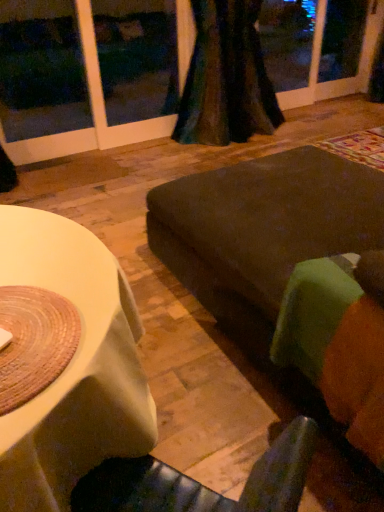
Question: From a real-world perspective, is dark brown fabric couch at center, which appears as the 1th couch when viewed from the back, physically above velvet dark green curtain at upper center?

Choices:
 (A) yes
 (B) no

Answer: (B)

Question: Considering the relative positions of dark brown fabric couch at center, which appears as the 1th couch when viewed from the back, and velvet dark green curtain at upper center in the image provided, is dark brown fabric couch at center, which appears as the 1th couch when viewed from the back, to the right of velvet dark green curtain at upper center from the viewer's perspective?

Choices:
 (A) yes
 (B) no

Answer: (A)

Question: Considering the relative sizes of dark brown fabric couch at center, which appears as the 1th couch when viewed from the back, and velvet dark green curtain at upper center in the image provided, is dark brown fabric couch at center, which appears as the 1th couch when viewed from the back, taller than velvet dark green curtain at upper center?

Choices:
 (A) no
 (B) yes

Answer: (A)

Question: Is the depth of dark brown fabric couch at center, which appears as the 1th couch when viewed from the back, less than that of velvet dark green curtain at upper center?

Choices:
 (A) no
 (B) yes

Answer: (B)

Question: From the image's perspective, is dark brown fabric couch at center, placed as the second couch when sorted from front to back, on velvet dark green curtain at upper center?

Choices:
 (A) no
 (B) yes

Answer: (A)

Question: Looking at the image, does dark brown fabric couch at center, which appears as the 1th couch when viewed from the back, seem bigger or smaller compared to velvet dark green curtain at upper center?

Choices:
 (A) big
 (B) small

Answer: (A)

Question: Is dark brown fabric couch at center, which appears as the 1th couch when viewed from the back, to the left or to the right of velvet dark green curtain at upper center in the image?

Choices:
 (A) right
 (B) left

Answer: (A)

Question: Is dark brown fabric couch at center, placed as the second couch when sorted from front to back, taller or shorter than velvet dark green curtain at upper center?

Choices:
 (A) tall
 (B) short

Answer: (B)

Question: Relative to velvet dark green curtain at upper center, is dark brown fabric couch at center, placed as the second couch when sorted from front to back, in front or behind?

Choices:
 (A) front
 (B) behind

Answer: (A)

Question: Considering the relative positions of green fabric couch at lower right, the second couch in the back-to-front sequence, and velvet dark green curtain at upper center in the image provided, is green fabric couch at lower right, the second couch in the back-to-front sequence, to the left or to the right of velvet dark green curtain at upper center?

Choices:
 (A) right
 (B) left

Answer: (A)

Question: From the image's perspective, relative to velvet dark green curtain at upper center, is green fabric couch at lower right, the first couch in the front-to-back sequence, above or below?

Choices:
 (A) below
 (B) above

Answer: (A)

Question: Choose the correct answer: Is green fabric couch at lower right, the first couch in the front-to-back sequence, inside velvet dark green curtain at upper center or outside it?

Choices:
 (A) outside
 (B) inside

Answer: (A)

Question: Considering the positions of green fabric couch at lower right, the first couch in the front-to-back sequence, and velvet dark green curtain at upper center in the image, is green fabric couch at lower right, the first couch in the front-to-back sequence, taller or shorter than velvet dark green curtain at upper center?

Choices:
 (A) tall
 (B) short

Answer: (B)

Question: Considering the positions of point (269, 211) and point (342, 282), is point (269, 211) closer or farther from the camera than point (342, 282)?

Choices:
 (A) closer
 (B) farther

Answer: (B)

Question: From a real-world perspective, relative to green fabric couch at lower right, the second couch in the back-to-front sequence, is dark brown fabric couch at center, which appears as the 1th couch when viewed from the back, vertically above or below?

Choices:
 (A) above
 (B) below

Answer: (B)